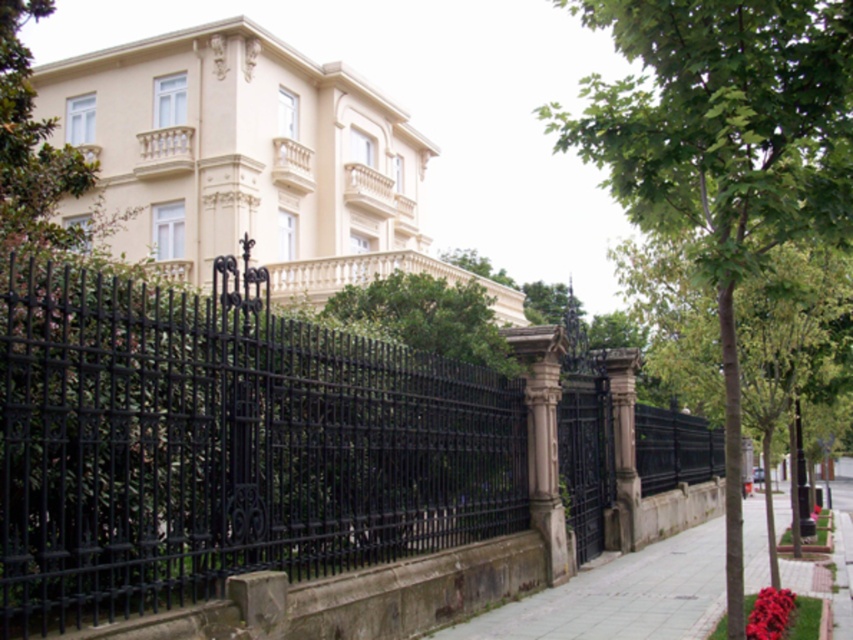
Can you confirm if black wrought iron fence at center is positioned to the left of green leafy tree at center?

Yes, black wrought iron fence at center is to the left of green leafy tree at center.

Is point (19, 444) positioned behind point (648, 93)?

No, (19, 444) is in front of (648, 93).

Who is more distant from viewer, (125, 557) or (669, 44)?

Positioned behind is point (669, 44).

At what (x,y) coordinates should I click in order to perform the action: click on black wrought iron fence at center. Please return your answer as a coordinate pair (x, y). Looking at the image, I should click on [x=224, y=445].